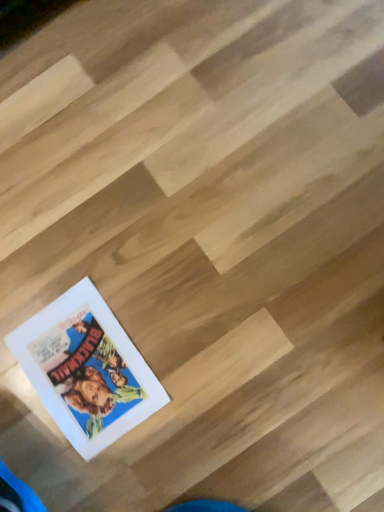
Locate an element on the screen. Image resolution: width=384 pixels, height=512 pixels. free space that is to the left of matte paper book at bottom left is located at coordinates (32, 430).